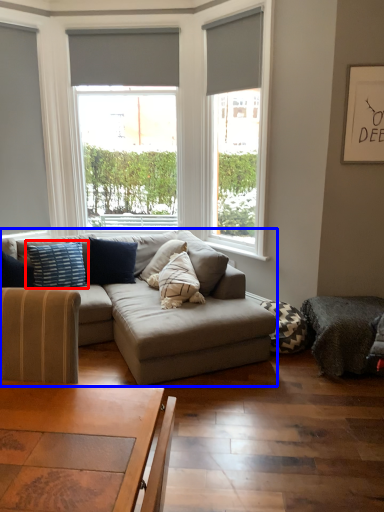
Question: Among these objects, which one is nearest to the camera, pillow (highlighted by a red box) or studio couch (highlighted by a blue box)?

Choices:
 (A) pillow
 (B) studio couch

Answer: (B)